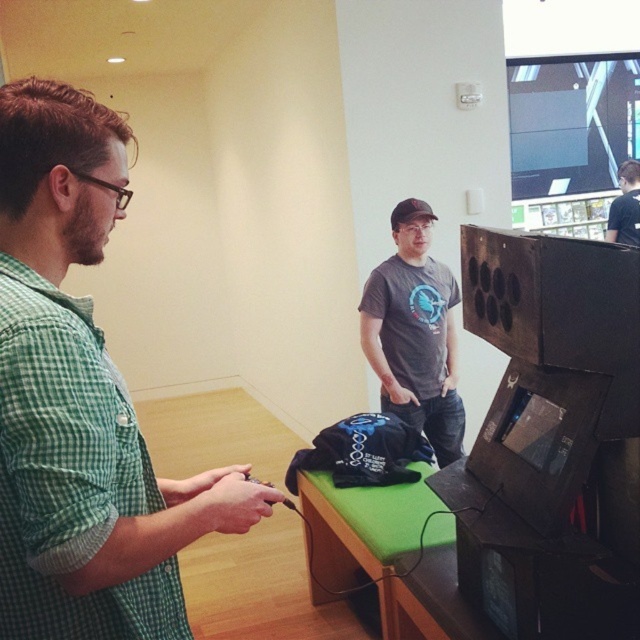
Question: Which object appears farthest from the camera in this image?

Choices:
 (A) gray matte t-shirt at center
 (B) black matte shirt at center
 (C) green checkered shirt at left

Answer: (B)

Question: Is green checkered shirt at left smaller than gray matte t-shirt at center?

Choices:
 (A) no
 (B) yes

Answer: (B)

Question: Which of the following is the farthest from the observer?

Choices:
 (A) (634, 196)
 (B) (394, 365)
 (C) (198, 476)

Answer: (A)

Question: Which of the following is the closest to the observer?

Choices:
 (A) (220, 531)
 (B) (625, 211)
 (C) (444, 387)

Answer: (A)

Question: Is green checkered shirt at left thinner than black matte shirt at center?

Choices:
 (A) no
 (B) yes

Answer: (A)

Question: Is green checkered shirt at left in front of gray matte t-shirt at center?

Choices:
 (A) yes
 (B) no

Answer: (A)